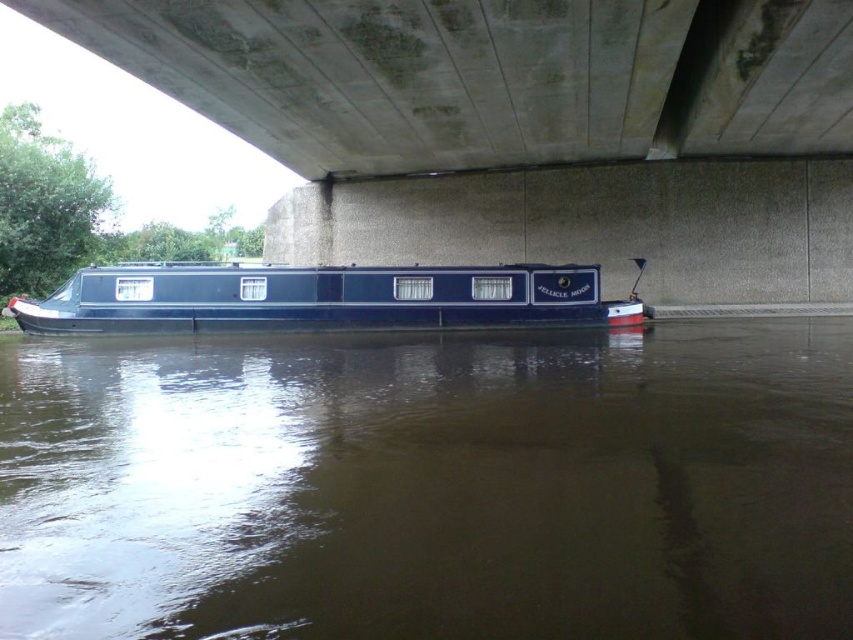
Is brown murky water at center taller than shiny blue boat at center?

No.

Find the location of `brown murky water at center`. brown murky water at center is located at coordinates (430, 484).

Can you confirm if brown murky water at center is positioned to the right of concrete at upper center?

In fact, brown murky water at center is to the left of concrete at upper center.

Can you confirm if brown murky water at center is positioned below concrete at upper center?

Yes.

Is point (636, 380) positioned after point (624, 115)?

No.

Image resolution: width=853 pixels, height=640 pixels. In order to click on brown murky water at center in this screenshot , I will do `click(430, 484)`.

Does concrete at upper center have a smaller size compared to shiny blue boat at center?

Correct, concrete at upper center occupies less space than shiny blue boat at center.

Is concrete at upper center thinner than shiny blue boat at center?

Indeed, concrete at upper center has a lesser width compared to shiny blue boat at center.

Is point (102, 32) positioned behind point (236, 276)?

That is False.

You are a GUI agent. You are given a task and a screenshot of the screen. Output one action in this format:
    pyautogui.click(x=<x>, y=<y>)
    Task: Click on the concrete at upper center
    
    Given the screenshot: What is the action you would take?
    pyautogui.click(x=486, y=76)